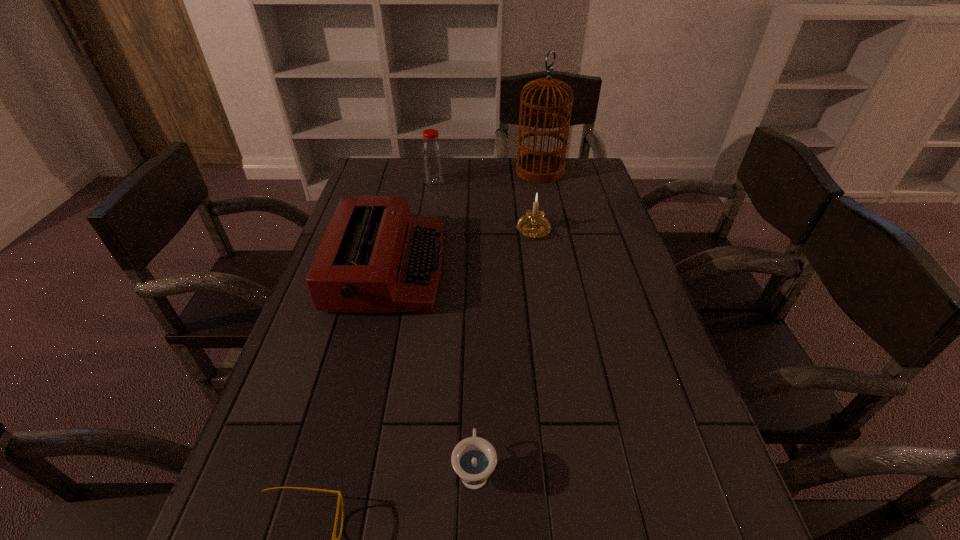
Locate an element on the screen. birdcage is located at coordinates (534, 166).

Find the location of `the fifth shortest object`. the fifth shortest object is located at coordinates (432, 159).

Where is `candle holder`? This screenshot has width=960, height=540. candle holder is located at coordinates (533, 224).

Where is `typewriter`? This screenshot has height=540, width=960. typewriter is located at coordinates (376, 256).

Find the location of a particular element. The image size is (960, 540). the fifth tallest object is located at coordinates (473, 459).

Identify the location of teacup. The height and width of the screenshot is (540, 960). 473,459.

Where is `vacant space situated 0.180m on the front of the birdcage`? This screenshot has height=540, width=960. vacant space situated 0.180m on the front of the birdcage is located at coordinates (548, 212).

You are a GUI agent. You are given a task and a screenshot of the screen. Output one action in this format:
    pyautogui.click(x=<x>, y=<y>)
    Task: Click on the vacant space located on the left of the bottle
    This screenshot has height=540, width=960.
    Given the screenshot: What is the action you would take?
    pyautogui.click(x=397, y=181)

Where is `vacant space positioned on the handle side of the candle holder`? vacant space positioned on the handle side of the candle holder is located at coordinates (542, 288).

Locate an element on the screen. blank area located on the typing side of the typewriter is located at coordinates (549, 268).